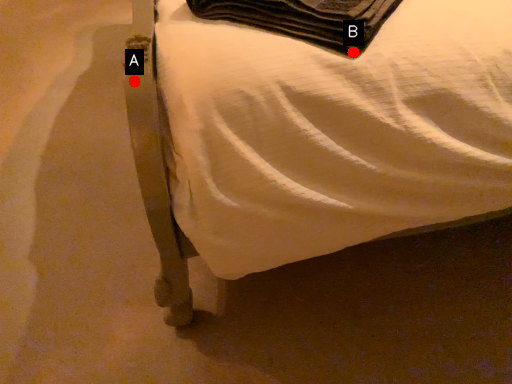
Question: Two points are circled on the image, labeled by A and B beside each circle. Which point is closer to the camera?

Choices:
 (A) A is closer
 (B) B is closer

Answer: (A)